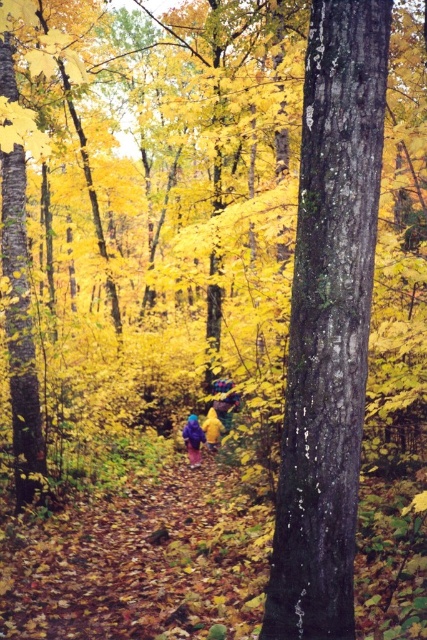
Who is more forward, [181,435] or [224,432]?

Point [224,432] is more forward.

Does point (193, 451) lie in front of point (210, 406)?

Yes, it is.

Where is `raincoat at center`? This screenshot has height=640, width=427. raincoat at center is located at coordinates (193, 440).

Who is taller, smooth dark bark tree at center or yellow fabric at center?

smooth dark bark tree at center

Does smooth dark bark tree at center have a greater width compared to yellow fabric at center?

Correct, the width of smooth dark bark tree at center exceeds that of yellow fabric at center.

Between point (362, 252) and point (216, 442), which one is positioned behind?

Positioned behind is point (216, 442).

Where is `smooth dark bark tree at center`? smooth dark bark tree at center is located at coordinates (328, 321).

Between point (327, 364) and point (199, 460), which one is positioned behind?

Point (199, 460)

In order to click on smooth dark bark tree at center in this screenshot , I will do `click(328, 321)`.

Is point (321, 129) positioned in front of point (190, 424)?

Yes, it is.

Find the location of a particular element. This screenshot has height=640, width=427. smooth dark bark tree at center is located at coordinates (328, 321).